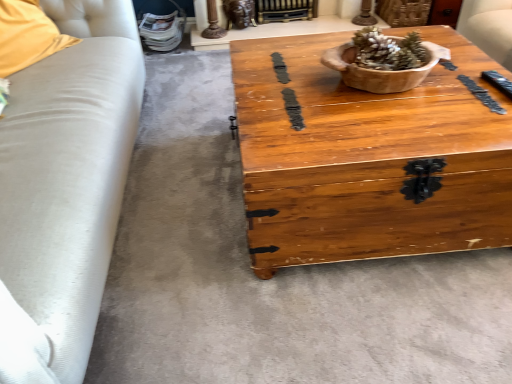
Question: Is gold metallic fireplace at upper center positioned far away from wooden chest at center?

Choices:
 (A) yes
 (B) no

Answer: (A)

Question: Does gold metallic fireplace at upper center have a greater width compared to wooden chest at center?

Choices:
 (A) yes
 (B) no

Answer: (B)

Question: Is gold metallic fireplace at upper center to the left of wooden chest at center from the viewer's perspective?

Choices:
 (A) yes
 (B) no

Answer: (A)

Question: From the image's perspective, is gold metallic fireplace at upper center above wooden chest at center?

Choices:
 (A) yes
 (B) no

Answer: (A)

Question: Is gold metallic fireplace at upper center not within wooden chest at center?

Choices:
 (A) no
 (B) yes

Answer: (B)

Question: From the image's perspective, relative to wooden bowl at center, is soft yellow fabric pillow at left above or below?

Choices:
 (A) below
 (B) above

Answer: (B)

Question: Considering the positions of soft yellow fabric pillow at left and wooden bowl at center in the image, is soft yellow fabric pillow at left taller or shorter than wooden bowl at center?

Choices:
 (A) tall
 (B) short

Answer: (A)

Question: In the image, is soft yellow fabric pillow at left on the left side or the right side of wooden bowl at center?

Choices:
 (A) left
 (B) right

Answer: (A)

Question: Is soft yellow fabric pillow at left inside the boundaries of wooden bowl at center, or outside?

Choices:
 (A) outside
 (B) inside

Answer: (A)

Question: In the image, is soft yellow fabric pillow at left positioned in front of or behind gold metallic fireplace at upper center?

Choices:
 (A) behind
 (B) front

Answer: (B)

Question: Would you say soft yellow fabric pillow at left is to the left or to the right of gold metallic fireplace at upper center in the picture?

Choices:
 (A) right
 (B) left

Answer: (B)

Question: From the image's perspective, is soft yellow fabric pillow at left located above or below gold metallic fireplace at upper center?

Choices:
 (A) below
 (B) above

Answer: (A)

Question: From their relative heights in the image, would you say soft yellow fabric pillow at left is taller or shorter than gold metallic fireplace at upper center?

Choices:
 (A) short
 (B) tall

Answer: (B)

Question: From a real-world perspective, is wooden chest at center positioned above or below gold metallic fireplace at upper center?

Choices:
 (A) below
 (B) above

Answer: (B)

Question: Does point (266, 74) appear closer or farther from the camera than point (291, 19)?

Choices:
 (A) farther
 (B) closer

Answer: (B)